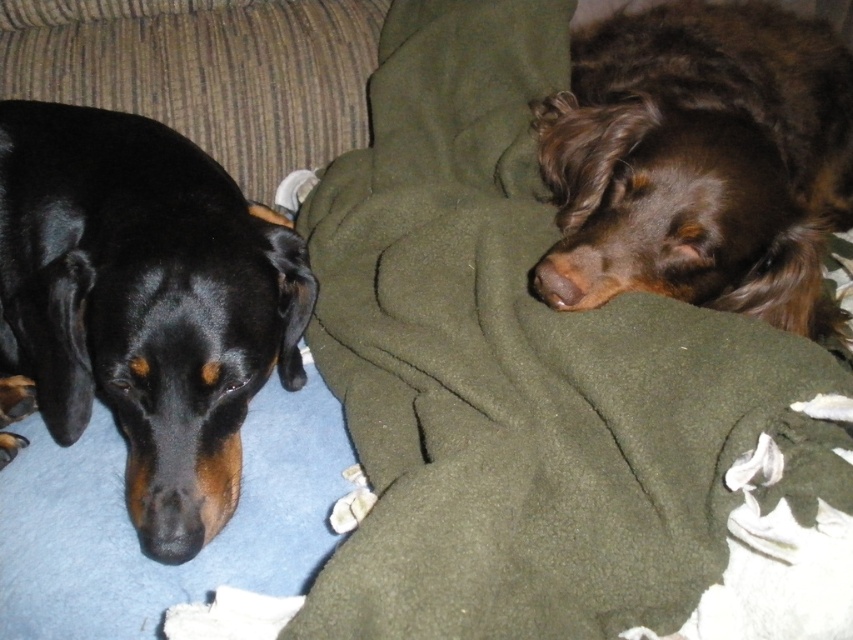
Question: Which point is closer to the camera?

Choices:
 (A) (705, 49)
 (B) (33, 314)
 (C) (372, 532)

Answer: (C)

Question: Does green fleece blanket at upper right have a lesser width compared to black matte dog at left?

Choices:
 (A) no
 (B) yes

Answer: (A)

Question: Considering the relative positions of green fleece blanket at upper right and brown fuzzy dog at center in the image provided, where is green fleece blanket at upper right located with respect to brown fuzzy dog at center?

Choices:
 (A) right
 (B) left

Answer: (B)

Question: Among these points, which one is nearest to the camera?

Choices:
 (A) (502, 323)
 (B) (579, 49)
 (C) (35, 288)

Answer: (A)

Question: Which object is the closest to the green fleece blanket at upper right?

Choices:
 (A) black matte dog at left
 (B) brown fuzzy dog at center

Answer: (B)

Question: Does green fleece blanket at upper right have a greater width compared to black matte dog at left?

Choices:
 (A) yes
 (B) no

Answer: (A)